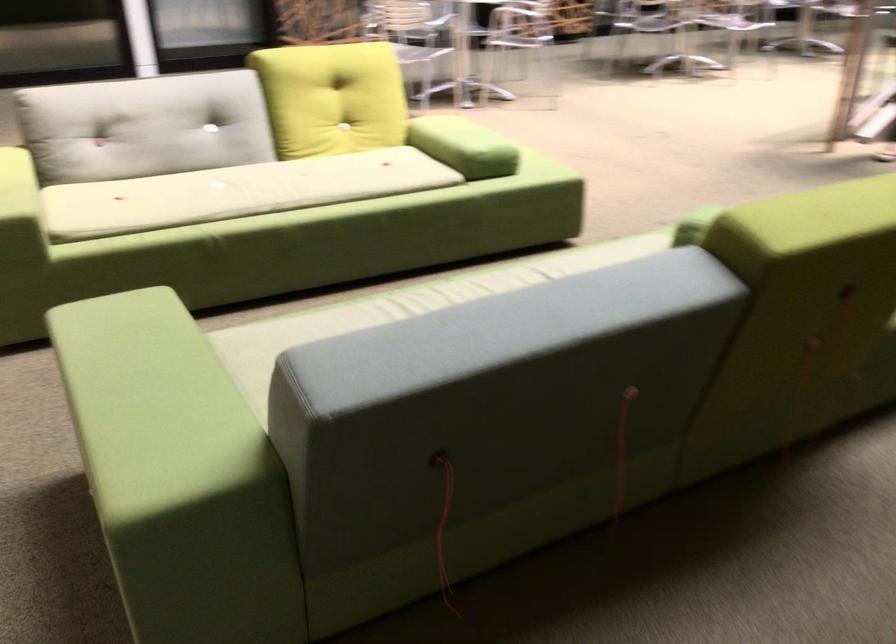
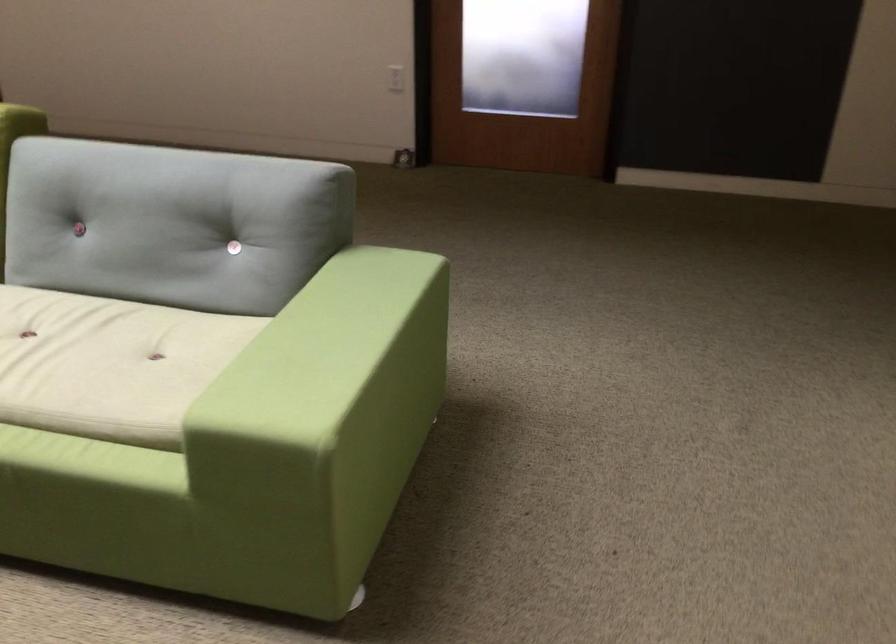
The point at [131,341] is marked in the first image. Where is the corresponding point in the second image?

(323, 353)